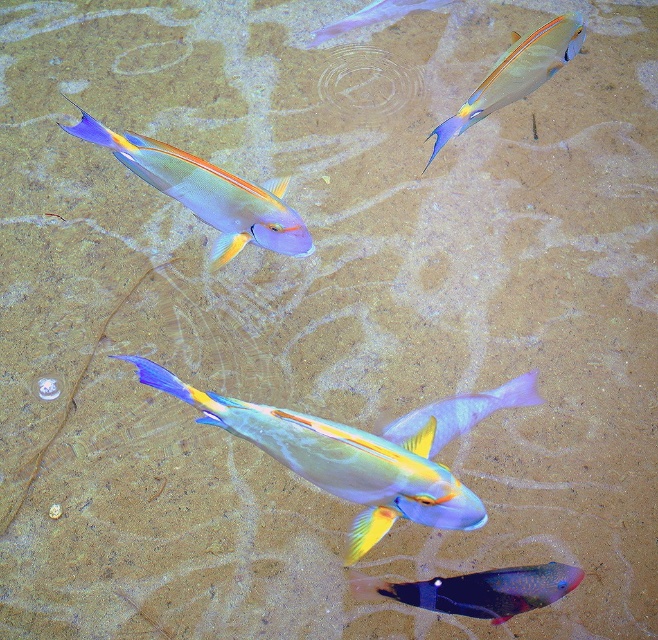
You are a marine biologist observing this underwater scene. You notice the shiny metallic fish at upper right and the translucent purple fish at upper center. Which fish is smaller in size?

The shiny metallic fish at upper right is smaller in size compared to the translucent purple fish at upper center.

You are a marine biologist observing the underwater scene. You notice the translucent blue fish at lower center and the translucent purple fish at upper center. Which fish is positioned higher in the water column?

The translucent purple fish at upper center is positioned higher in the water column than the translucent blue fish at lower center.